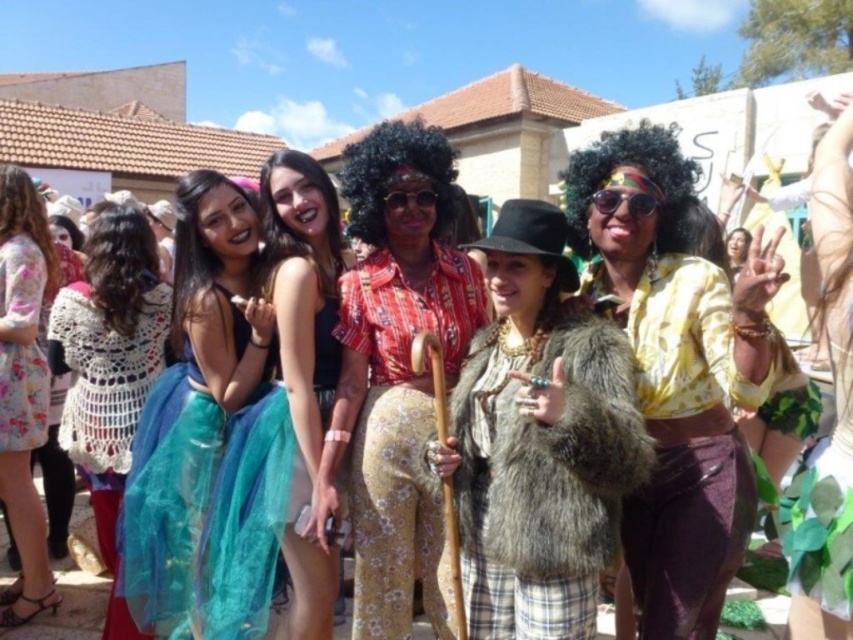
Question: Which of the following is the closest to the observer?

Choices:
 (A) (412, 381)
 (B) (561, 273)
 (C) (97, 532)
 (D) (572, 216)

Answer: (B)

Question: Does crochet sweater at left appear on the right side of shiny black dress at center?

Choices:
 (A) no
 (B) yes

Answer: (A)

Question: Which point appears closest to the camera in this image?

Choices:
 (A) (112, 362)
 (B) (189, 620)
 (C) (616, 291)

Answer: (C)

Question: Does floral dress at left have a smaller size compared to floral-patterned fabric dress at left?

Choices:
 (A) yes
 (B) no

Answer: (B)

Question: Can you confirm if crochet sweater at left is positioned above floral-patterned fabric dress at left?

Choices:
 (A) yes
 (B) no

Answer: (B)

Question: Which point is closer to the camera?

Choices:
 (A) (578, 547)
 (B) (426, 522)
 (C) (107, 392)

Answer: (A)